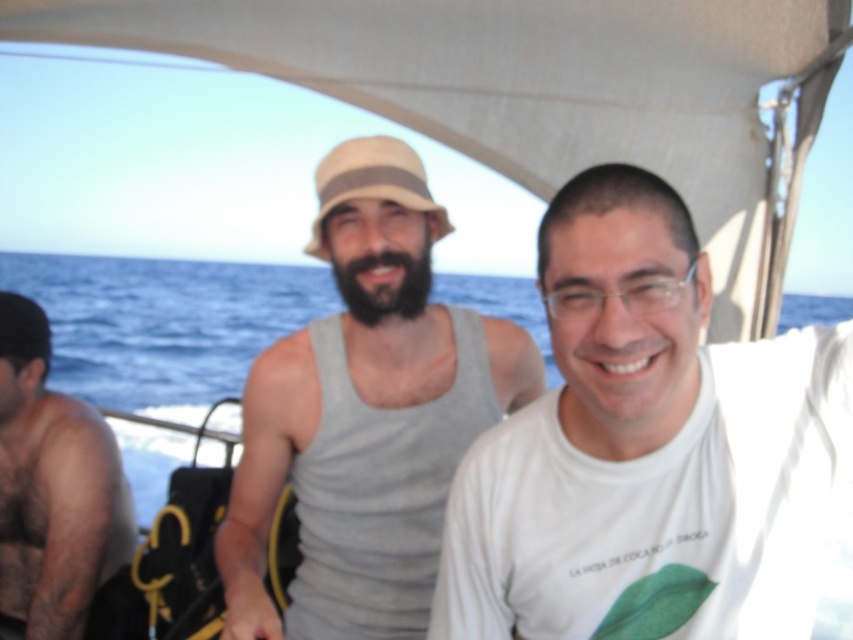
Question: Which of these objects is positioned farthest from the blue water at center?

Choices:
 (A) white matte t-shirt at center
 (B) skinny black tank top at left
 (C) gray matte tank top at center

Answer: (B)

Question: Does blue water at center have a lesser width compared to skinny black tank top at left?

Choices:
 (A) yes
 (B) no

Answer: (B)

Question: Is white matte t-shirt at center to the right of skinny black tank top at left from the viewer's perspective?

Choices:
 (A) yes
 (B) no

Answer: (A)

Question: Which object is closer to the camera taking this photo?

Choices:
 (A) white matte t-shirt at center
 (B) skinny black tank top at left

Answer: (A)

Question: Can you confirm if white matte t-shirt at center is thinner than gray matte tank top at center?

Choices:
 (A) yes
 (B) no

Answer: (A)

Question: Which point is farther from the camera taking this photo?

Choices:
 (A) (415, 413)
 (B) (213, 372)

Answer: (B)